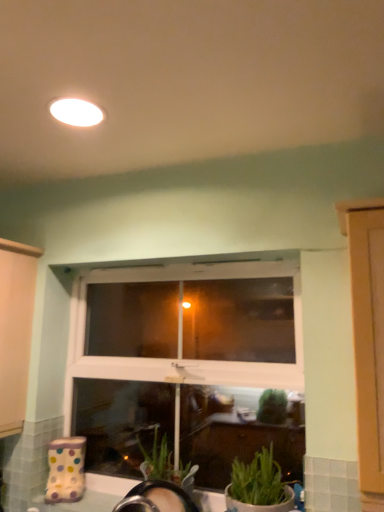
Question: Can you see green matte plant at lower right touching white matte light fixture at upper center?

Choices:
 (A) no
 (B) yes

Answer: (A)

Question: Can you confirm if green matte plant at lower right is shorter than white matte light fixture at upper center?

Choices:
 (A) yes
 (B) no

Answer: (B)

Question: From the image's perspective, is green matte plant at lower right above white matte light fixture at upper center?

Choices:
 (A) yes
 (B) no

Answer: (B)

Question: Does green matte plant at lower right come behind white matte light fixture at upper center?

Choices:
 (A) no
 (B) yes

Answer: (B)

Question: Are green matte plant at lower right and white matte light fixture at upper center located far from each other?

Choices:
 (A) yes
 (B) no

Answer: (A)

Question: Does point (67, 115) appear closer or farther from the camera than point (271, 484)?

Choices:
 (A) farther
 (B) closer

Answer: (B)

Question: Relative to green matte plant at lower right, is white matte light fixture at upper center in front or behind?

Choices:
 (A) behind
 (B) front

Answer: (B)

Question: Is white matte light fixture at upper center inside or outside of green matte plant at lower right?

Choices:
 (A) outside
 (B) inside

Answer: (A)

Question: From their relative heights in the image, would you say white matte light fixture at upper center is taller or shorter than green matte plant at lower right?

Choices:
 (A) tall
 (B) short

Answer: (B)

Question: In the image, is green matte plant at lower right positioned in front of or behind white matte light fixture at upper center?

Choices:
 (A) front
 (B) behind

Answer: (B)

Question: Considering the positions of green matte plant at lower right and white matte light fixture at upper center in the image, is green matte plant at lower right taller or shorter than white matte light fixture at upper center?

Choices:
 (A) short
 (B) tall

Answer: (B)

Question: Does point (228, 485) appear closer or farther from the camera than point (77, 105)?

Choices:
 (A) farther
 (B) closer

Answer: (A)

Question: Based on their positions, is green matte plant at lower right located to the left or right of white matte light fixture at upper center?

Choices:
 (A) left
 (B) right

Answer: (B)

Question: Considering the positions of white plastic window at center and green matte plant at lower right in the image, is white plastic window at center wider or thinner than green matte plant at lower right?

Choices:
 (A) thin
 (B) wide

Answer: (A)

Question: In terms of size, does white plastic window at center appear bigger or smaller than green matte plant at lower right?

Choices:
 (A) small
 (B) big

Answer: (B)